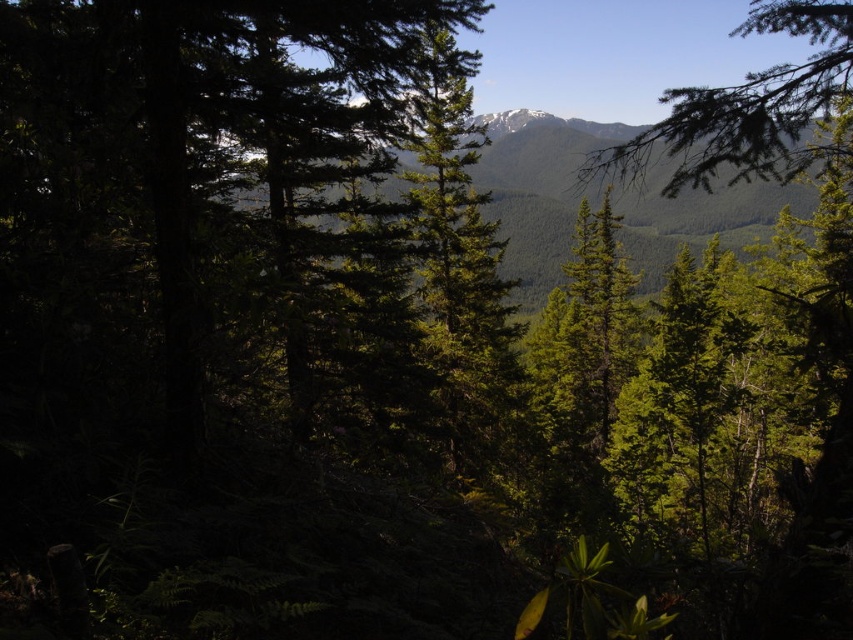
You are a hiker navigating through the forest and notice the green textured mountain at center and the green matte tree branch at upper right. Which object appears closer to you based on their positions in the scene?

The green matte tree branch at upper right is behind the green textured mountain at center, so the green textured mountain at center appears closer to you.